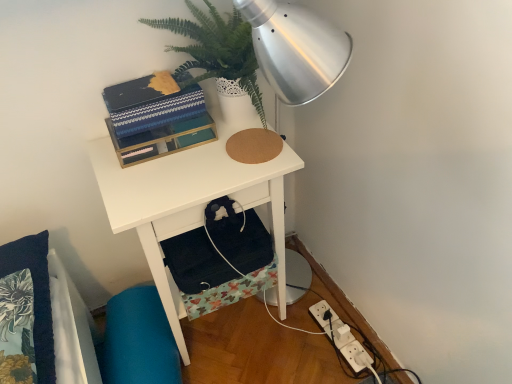
Image resolution: width=512 pixels, height=384 pixels. I want to click on vacant space situated above matte black book at upper center (from a real-world perspective), so click(x=142, y=86).